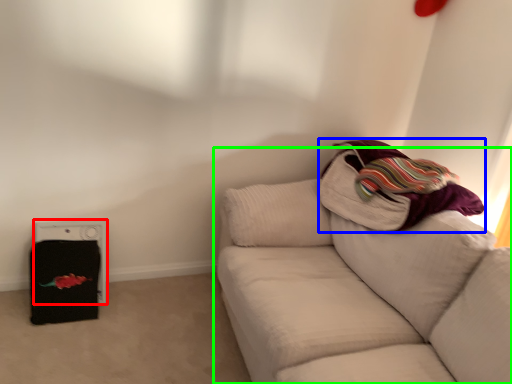
Question: Which object is the closest to the appliance (highlighted by a red box)? Choose among these: blanket (highlighted by a blue box) or studio couch (highlighted by a green box).

Choices:
 (A) blanket
 (B) studio couch

Answer: (B)